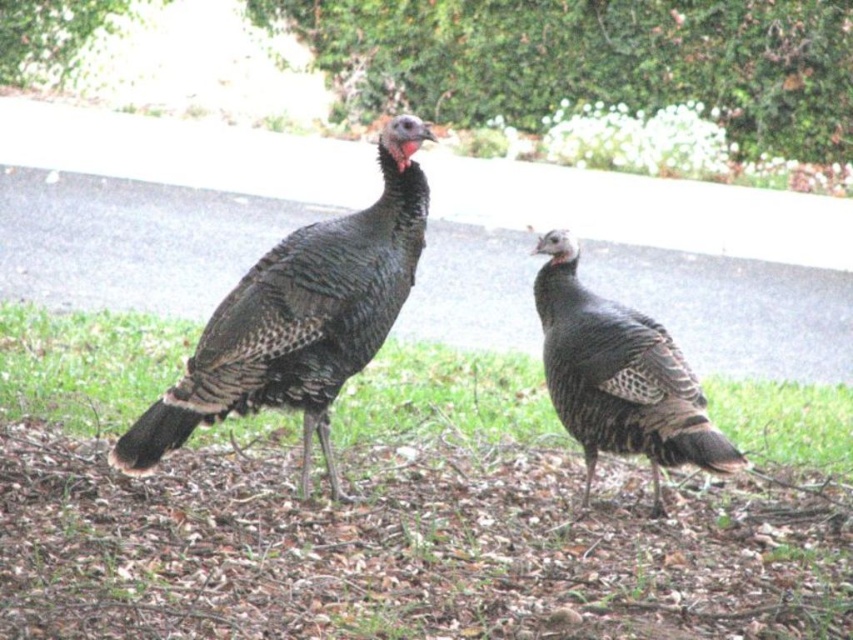
Which of these two, green grass at center or dark brown feathers at center, stands taller?

dark brown feathers at center

Where is `green grass at center`? This screenshot has width=853, height=640. green grass at center is located at coordinates (x=86, y=364).

The width and height of the screenshot is (853, 640). What do you see at coordinates (86, 364) in the screenshot? I see `green grass at center` at bounding box center [86, 364].

The width and height of the screenshot is (853, 640). Identify the location of green grass at center. (86, 364).

Which is in front, point (384, 125) or point (567, 364)?

Point (567, 364) is in front.

Who is more forward, (413, 129) or (583, 429)?

Point (413, 129)

You are a GUI agent. You are given a task and a screenshot of the screen. Output one action in this format:
    pyautogui.click(x=<x>, y=<y>)
    Task: Click on the dark brown feathers at center
    This screenshot has width=853, height=640.
    Given the screenshot: What is the action you would take?
    pyautogui.click(x=300, y=317)

Can you confirm if green grass at center is positioned above speckled feathered turkey at center?

Yes.

Does green grass at center have a lesser height compared to speckled feathered turkey at center?

Yes, green grass at center is shorter than speckled feathered turkey at center.

Describe the element at coordinates (86, 364) in the screenshot. I see `green grass at center` at that location.

Locate an element on the screen. The image size is (853, 640). green grass at center is located at coordinates (86, 364).